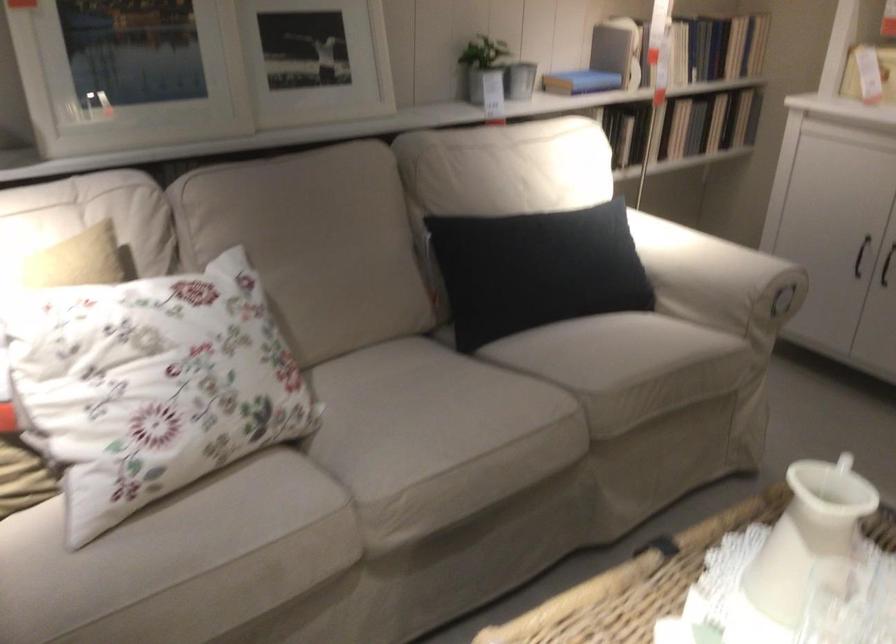
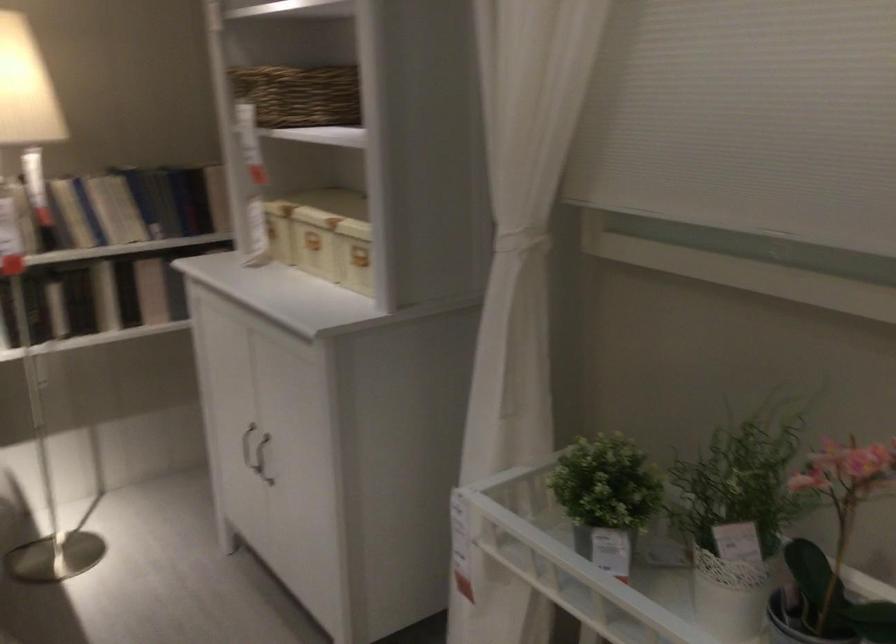
The point at (645, 129) is marked in the first image. Where is the corresponding point in the second image?

(55, 307)